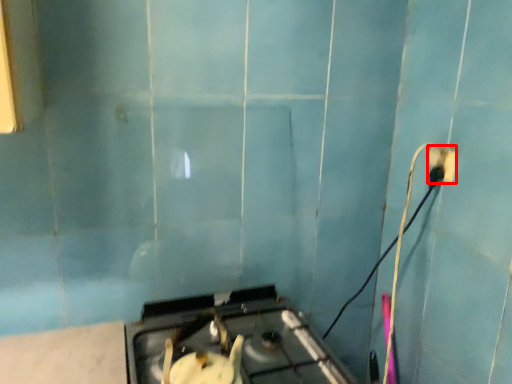
Question: From the image's perspective, what is the correct spatial relationship of power plugs and sockets (annotated by the red box) in relation to gas stove?

Choices:
 (A) above
 (B) below

Answer: (A)